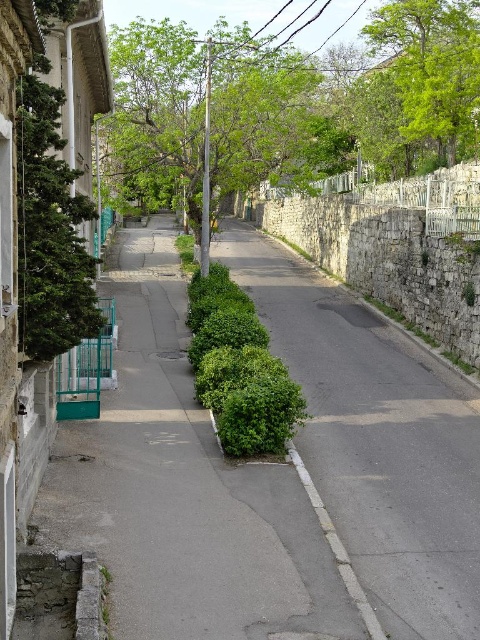
Question: Is green leafy bush at center below green leafy tree at upper center?

Choices:
 (A) yes
 (B) no

Answer: (A)

Question: Can you confirm if green leafy tree at upper center is positioned to the right of green leafy tree at upper right?

Choices:
 (A) yes
 (B) no

Answer: (B)

Question: Estimate the real-world distances between objects in this image. Which object is farther from the green leafy tree at upper right?

Choices:
 (A) green leafy tree at upper center
 (B) green leafy bush at center

Answer: (B)

Question: Considering the real-world distances, which object is closest to the green leafy tree at left?

Choices:
 (A) green leafy tree at upper right
 (B) green leafy tree at upper center
 (C) green leafy bush at center

Answer: (C)

Question: Among these objects, which one is farthest from the camera?

Choices:
 (A) green leafy tree at upper right
 (B) green leafy tree at upper center
 (C) green leafy bush at center
 (D) green leafy tree at left

Answer: (A)

Question: Where is green leafy bush at center located in relation to green leafy tree at upper right in the image?

Choices:
 (A) above
 (B) below

Answer: (B)